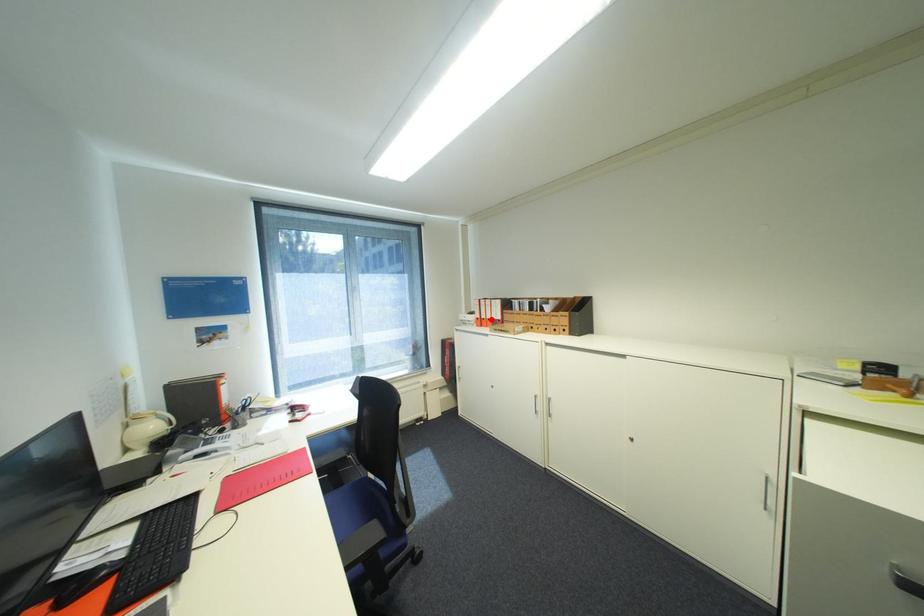
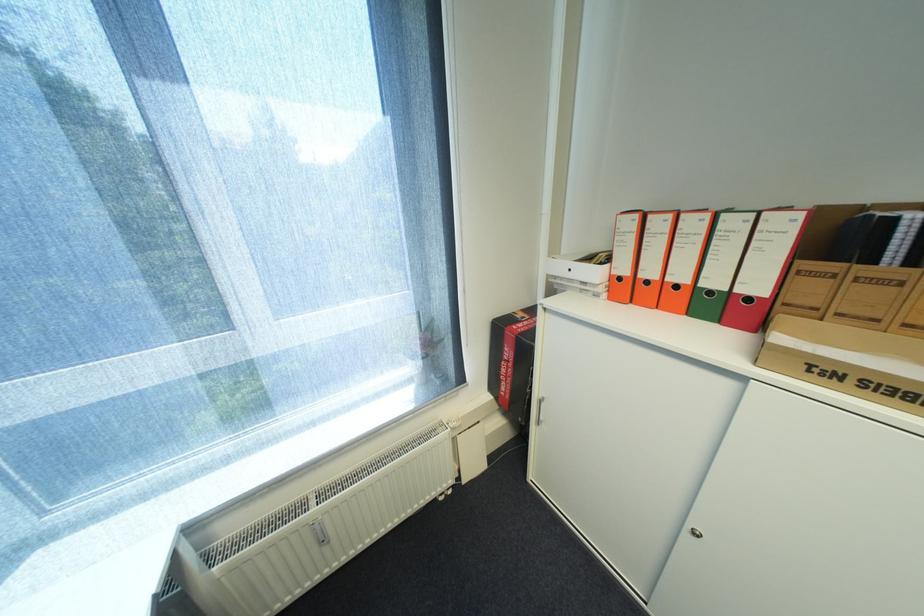
The point at the highlighted location is marked in the first image. Where is the corresponding point in the second image?

(655, 283)